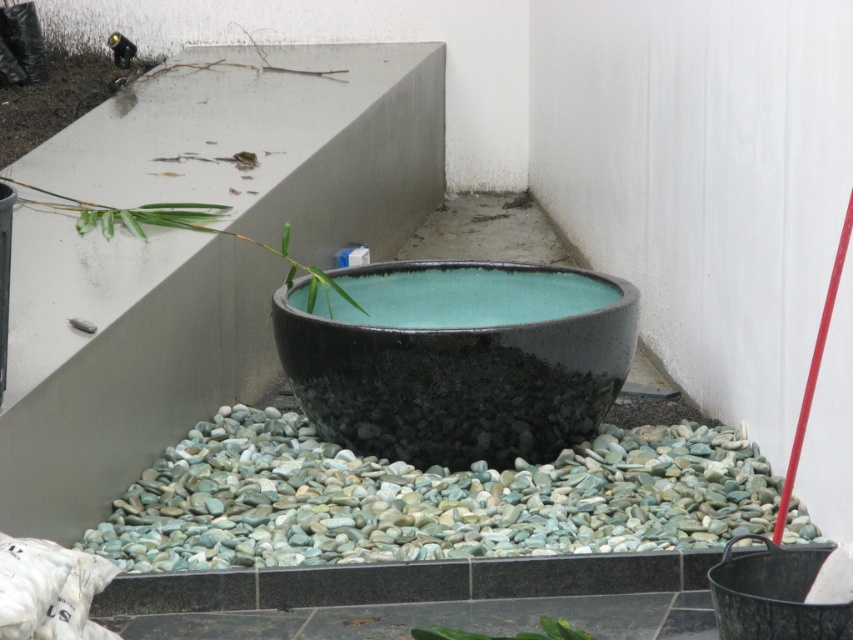
You are standing in the outdoor space and want to place a small statue between the two points, point (x=367, y=408) and point (x=360, y=307). To ensure it is visible from the front, where should you position the statue relative to these points?

The statue should be placed closer to point (x=367, y=408) since it is in front of point (x=360, y=307), ensuring visibility from the front.